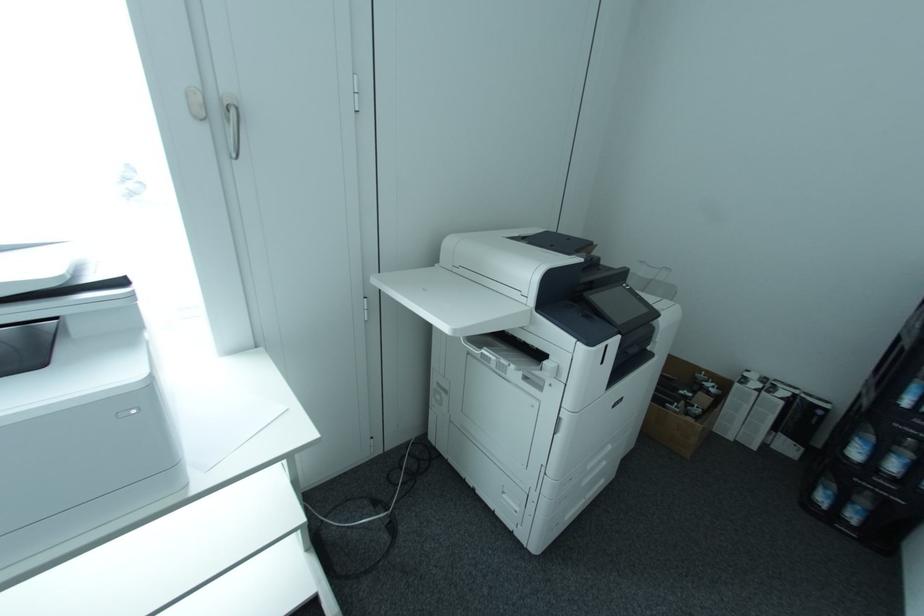
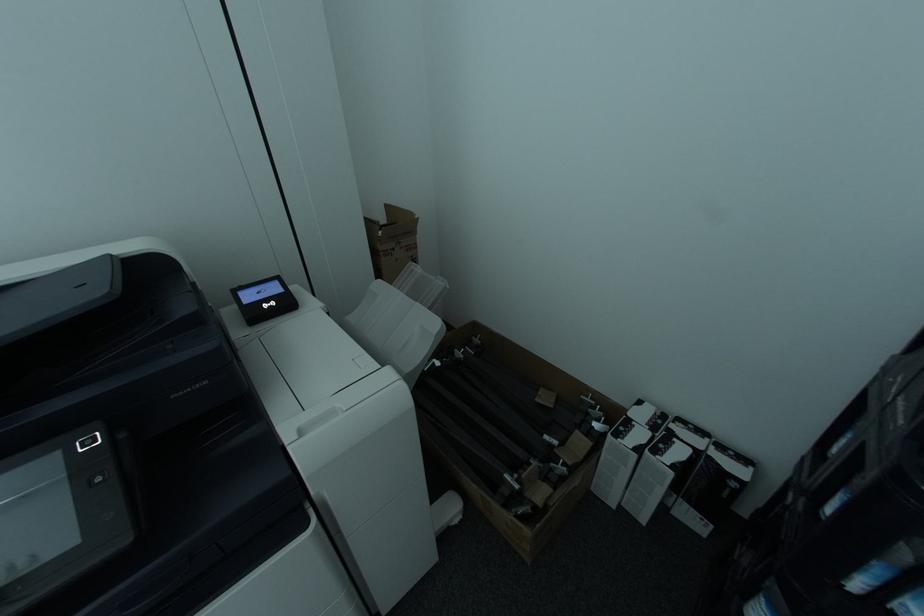
The images are taken continuously from a first-person perspective. In which direction are you moving?

The movement direction of the cameraman is right, forward.